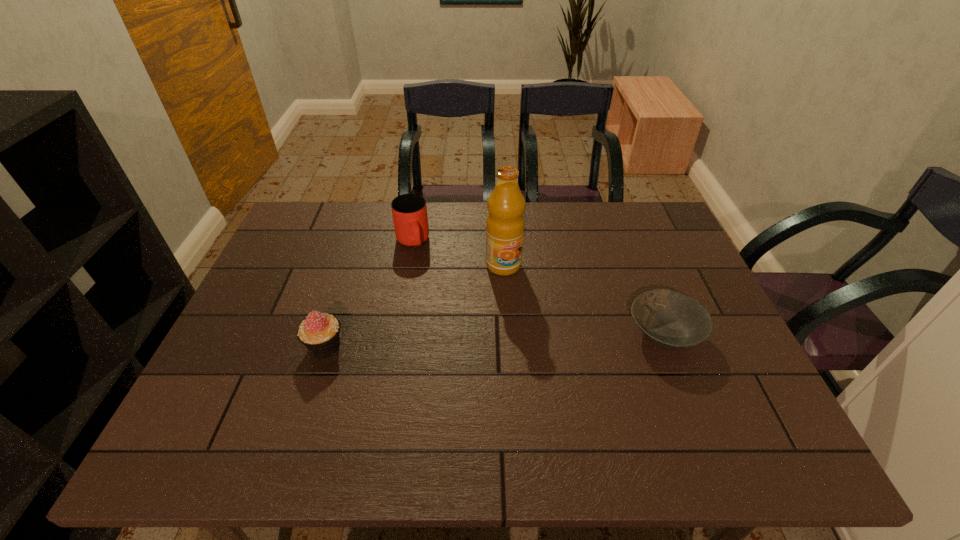
Point out which object is positioned as the third nearest to the shortest object. Please provide its 2D coordinates. Your answer should be formatted as a tuple, i.e. [(x, y)], where the tuple contains the x and y coordinates of a point satisfying the conditions above.

[(320, 333)]

Where is `object that ranks as the second closest to the third object from left to right`? object that ranks as the second closest to the third object from left to right is located at coordinates (671, 320).

Identify the location of vacant space that satisfies the following two spatial constraints: 1. on the back side of the leftmost object; 2. on the right side of the shortest object. The width and height of the screenshot is (960, 540). (329, 334).

I want to click on vacant space that satisfies the following two spatial constraints: 1. on the front side of the shortest object; 2. on the right side of the second object from left to right, so 396,334.